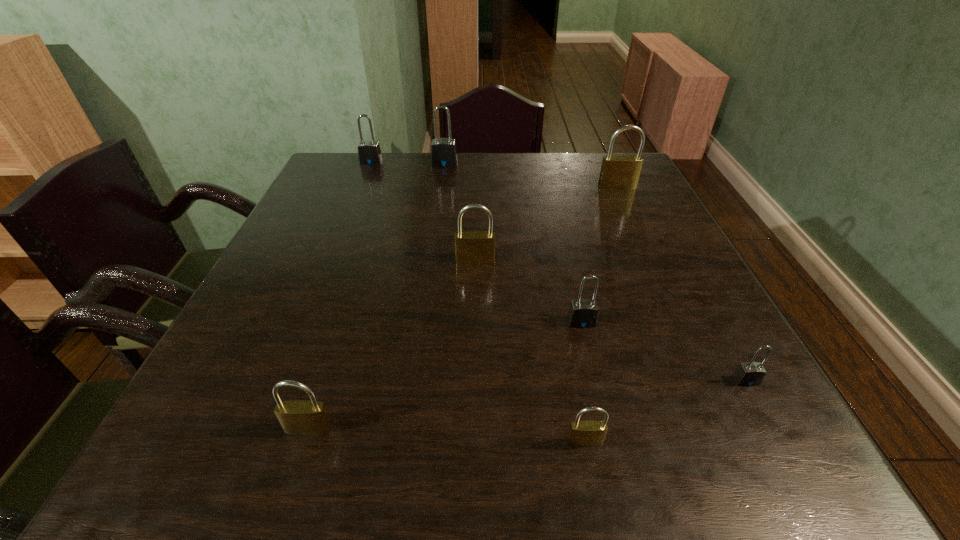
Locate an element on the screen. This screenshot has width=960, height=540. the sixth padlock from right to left is located at coordinates (443, 150).

The height and width of the screenshot is (540, 960). Find the location of `the biggest gray padlock`. the biggest gray padlock is located at coordinates (443, 150).

Where is `the third farthest padlock`? The height and width of the screenshot is (540, 960). the third farthest padlock is located at coordinates (618, 172).

Where is `the biggest brass padlock`? the biggest brass padlock is located at coordinates (618, 172).

At what (x,y) coordinates should I click in order to perform the action: click on the leftmost gray padlock. Please return your answer as a coordinate pair (x, y). This screenshot has height=540, width=960. Looking at the image, I should click on (369, 153).

What are the coordinates of `the leftmost object` in the screenshot? It's located at (369, 153).

Identify the location of the third brass padlock from right to left. The image size is (960, 540). (472, 247).

Identify the location of the fourth padlock from left to right. (472, 247).

This screenshot has width=960, height=540. What are the coordinates of `the fourth nearest padlock` in the screenshot? It's located at (583, 313).

At what (x,y) coordinates should I click in order to perform the action: click on the third biggest gray padlock. Please return your answer as a coordinate pair (x, y). Looking at the image, I should click on (583, 313).